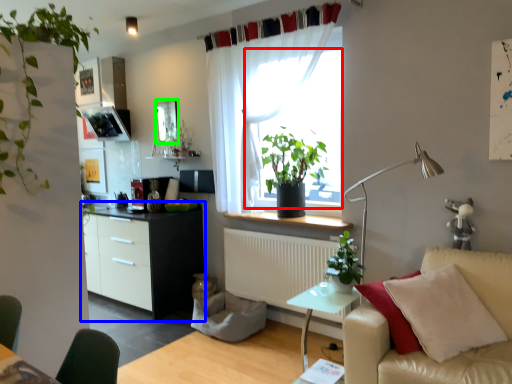
Question: Which is farther away from window screen (highlighted by a red box)? cabinetry (highlighted by a blue box) or window screen (highlighted by a green box)?

Choices:
 (A) cabinetry
 (B) window screen

Answer: (B)